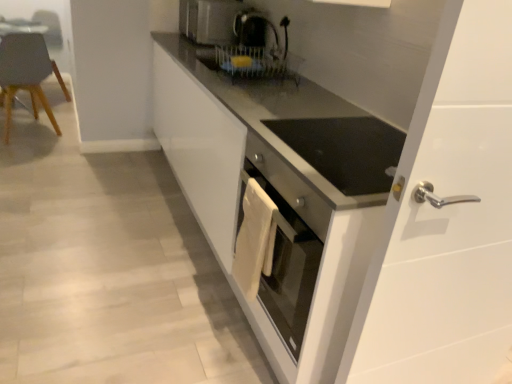
Where is `vacant space in matte gray chair at left (from a real-world perspective)`? Image resolution: width=512 pixels, height=384 pixels. vacant space in matte gray chair at left (from a real-world perspective) is located at coordinates (29, 135).